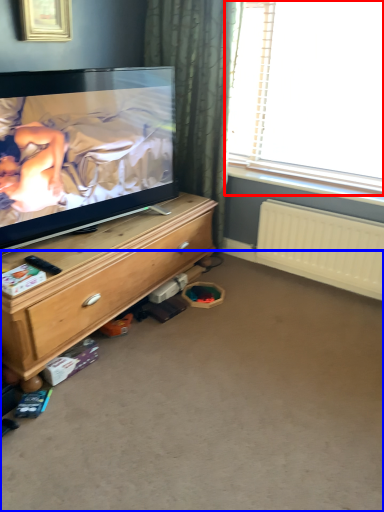
Question: Which object is closer to the camera taking this photo, window (highlighted by a red box) or plain (highlighted by a blue box)?

Choices:
 (A) window
 (B) plain

Answer: (B)